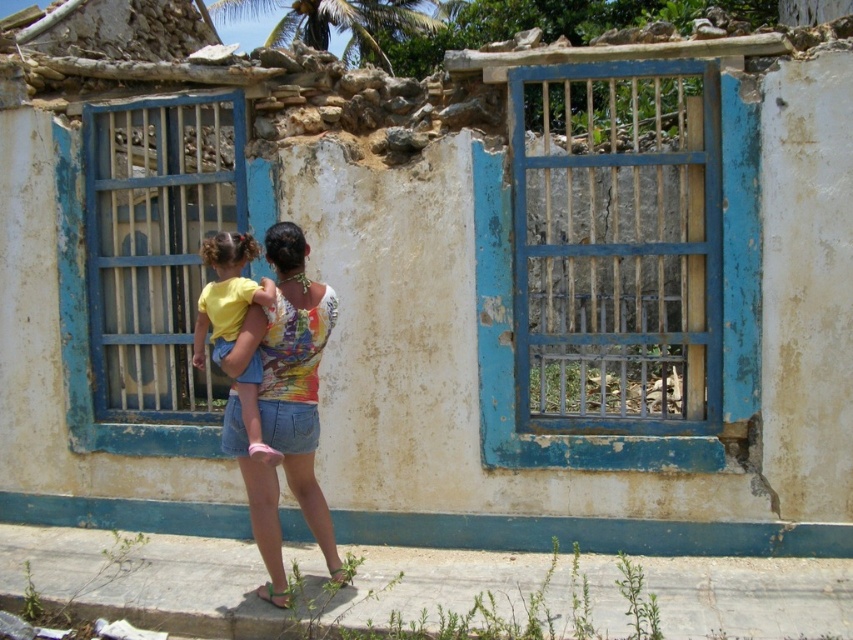
You are a fashion designer observing the scene. You notice the multicolored printed tank top at center and the yellow cotton shirt at center. Which clothing item is covering the other?

The multicolored printed tank top at center is positioned under the yellow cotton shirt at center, so the yellow cotton shirt is covering the multicolored printed tank top.